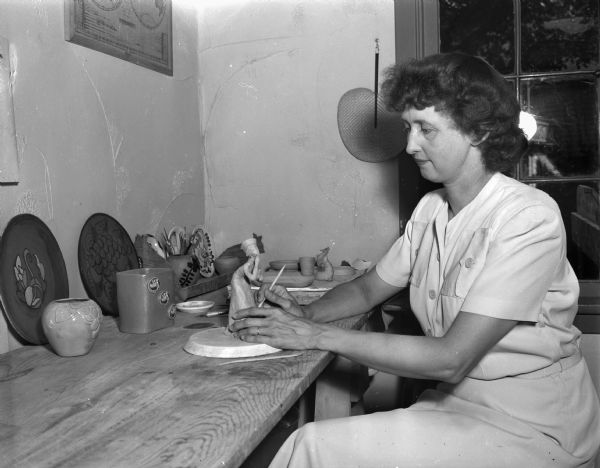
Find the location of a particular element. The image size is (600, 468). window is located at coordinates (572, 98).